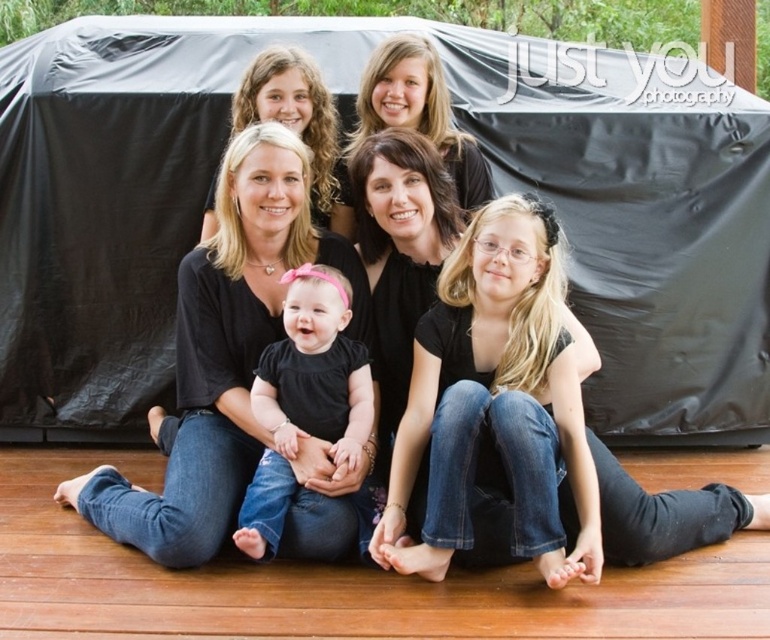
Is point (454, 436) more distant than point (487, 173)?

No, (454, 436) is closer to viewer.

Which is below, blonde hair at center or matte black shirt at upper center?

Positioned lower is blonde hair at center.

The width and height of the screenshot is (770, 640). Identify the location of blonde hair at center. (496, 401).

Is black matte shirt at center positioned in front of blonde hair at center?

No, it is not.

Can you confirm if black matte shirt at center is shorter than blonde hair at center?

No, black matte shirt at center is not shorter than blonde hair at center.

Is point (183, 451) more distant than point (464, 280)?

No, (183, 451) is in front of (464, 280).

Where is `black matte shirt at center`? black matte shirt at center is located at coordinates click(x=223, y=353).

The height and width of the screenshot is (640, 770). Describe the element at coordinates (305, 400) in the screenshot. I see `black matte dress at center` at that location.

Is black matte dress at center shorter than matte black shirt at upper center?

Incorrect, black matte dress at center's height does not fall short of matte black shirt at upper center's.

Is point (343, 342) positioned before point (414, 58)?

Yes, it is.

Locate an element on the screen. The image size is (770, 640). black matte dress at center is located at coordinates (305, 400).